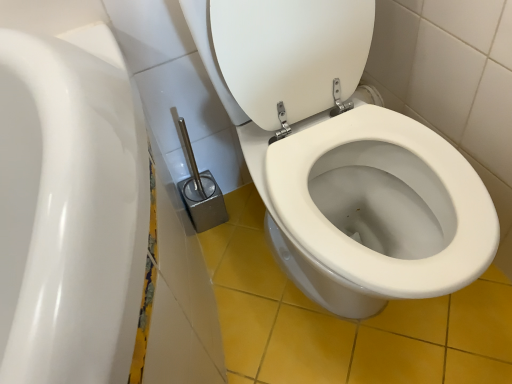
What is the approximate width of white glossy toilet at center?

72.22 centimeters.

What do you see at coordinates (341, 158) in the screenshot? The height and width of the screenshot is (384, 512). I see `white glossy toilet at center` at bounding box center [341, 158].

The image size is (512, 384). Identify the location of white glossy toilet at center. (341, 158).

Find the location of a particular element. white glossy toilet at center is located at coordinates (341, 158).